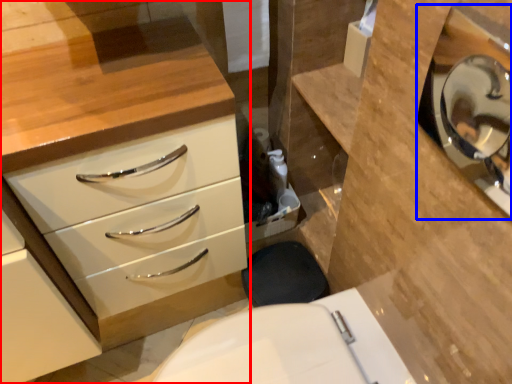
Question: Which object appears farthest to the camera in this image, chest of drawers (highlighted by a red box) or medicine cabinet (highlighted by a blue box)?

Choices:
 (A) chest of drawers
 (B) medicine cabinet

Answer: (A)